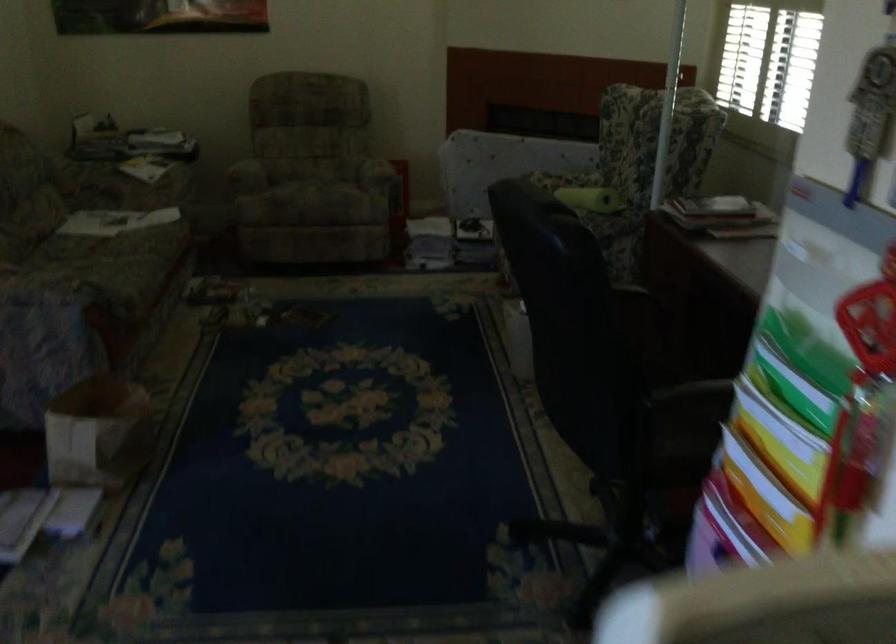
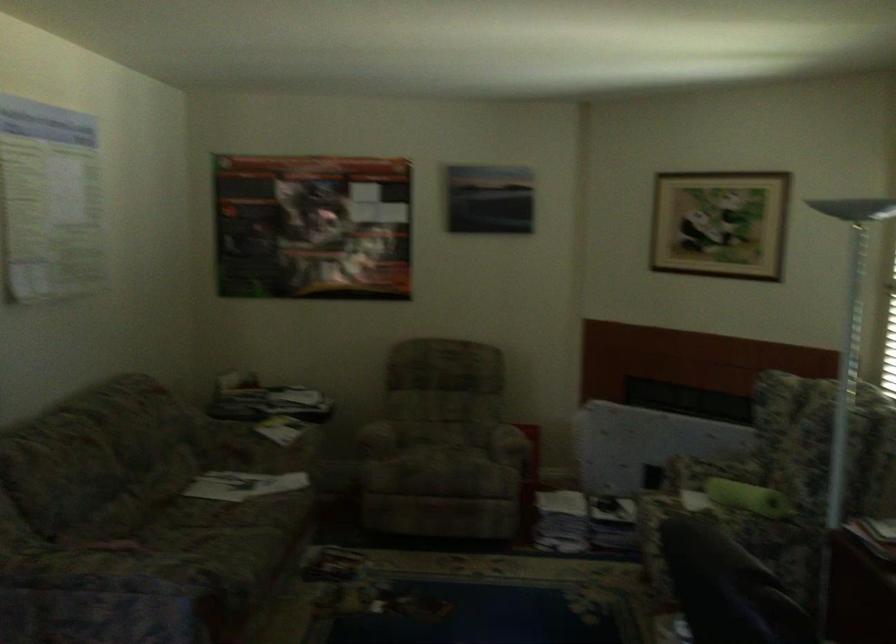
In the second image, find the point that corresponds to the point at 367,154 in the first image.

(506, 424)